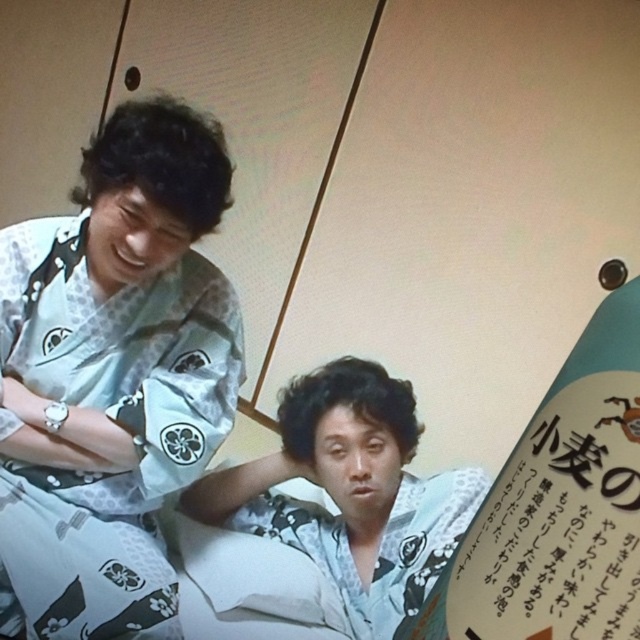
You are standing at the origin point of the image. Which of the two points, point (83, 301) or point (440, 570), is farther away from you?

Point (83, 301) is behind point (440, 570), so it is farther away from you.

You are organizing a traditional Japanese festival and need to arrange the white floral kimono at left and the white floral kimono at center on a display rack. Which kimono should be placed on the rack first to ensure both fit properly?

The white floral kimono at left should be placed first because it is narrower than the white floral kimono at center, allowing more space for the wider one afterward.

You are a photographer standing at the scene. You want to take a portrait of the white floral kimono at left. What is the minimum distance you need to maintain to ensure the entire kimono is in frame?

The minimum distance you need to maintain is 3.70 feet to ensure the entire white floral kimono at left is in frame.